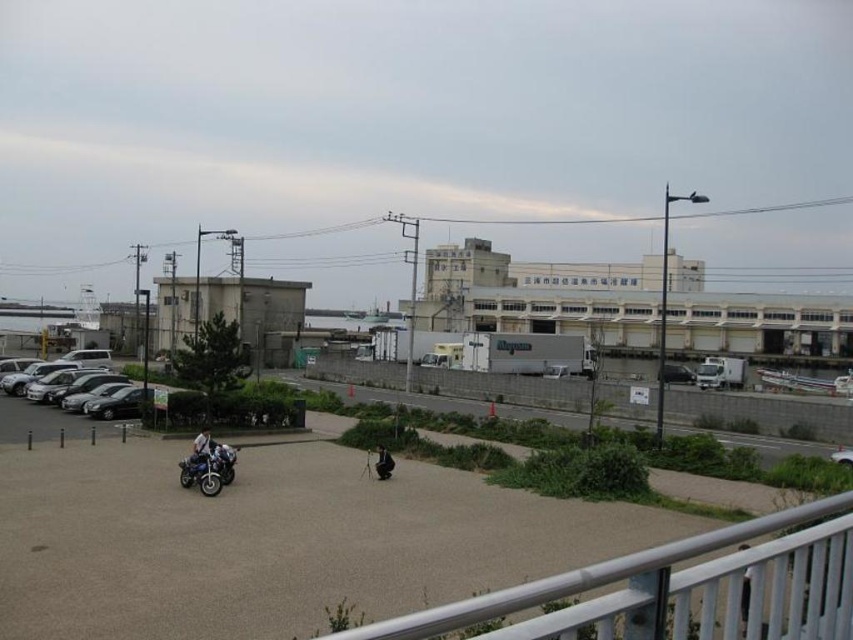
You are standing on the paved area near the metal railing and want to move towards the shiny metallic motorcycle at lower left. Based on your position, is the motorcycle positioned to your left or right side?

The shiny metallic motorcycle at lower left is located at point coordinates that place it to the left side from your perspective, so it is positioned to your left.

You are standing at point (65, 387) and want to walk to the nearest motorcycle. Which direction should you go?

The nearest motorcycle is located to the left of point (65, 387) where the silver metallic car is situated.

You are standing at point (206, 484) and want to walk to the edge of the paved area. Is point (56, 380) located behind you or in front of you relative to your direction of movement?

Point (56, 380) is behind point (206, 484), so it is behind you relative to your direction of movement towards the edge of the paved area.